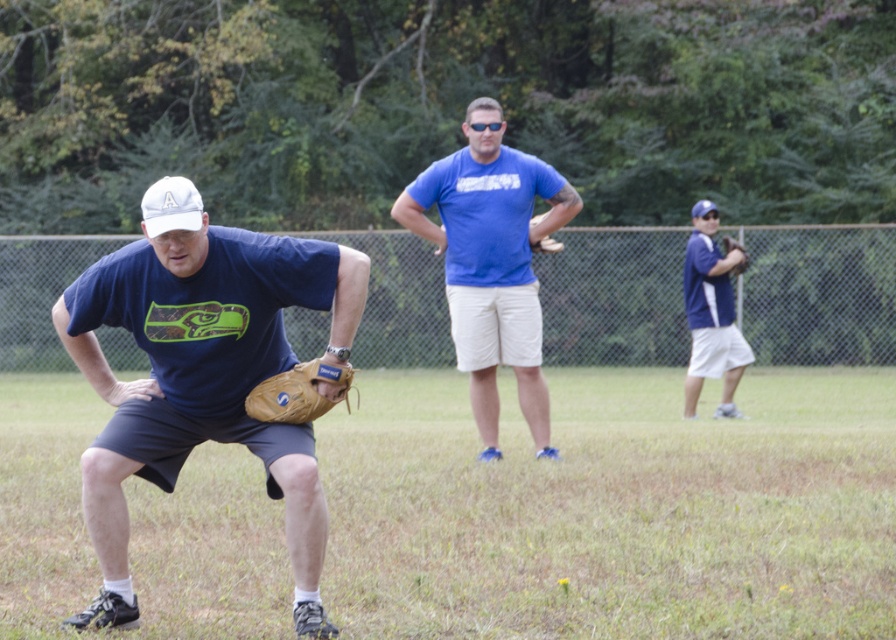
You are a player in the baseball game and you want to retrieve the baseball from the field. You see the brown leather baseball glove at center and the brown leather glove at center. Which one is farther from you?

The brown leather baseball glove at center is 30.74 feet away from brown leather glove at center, so the brown leather baseball glove at center is farther away from you.